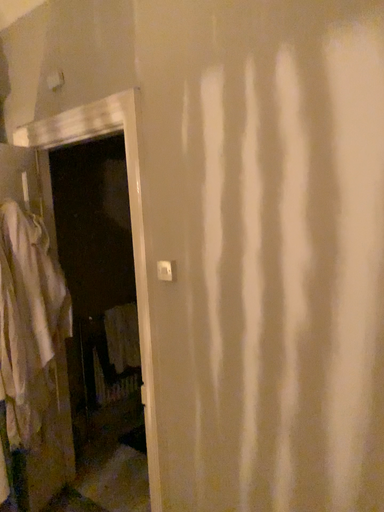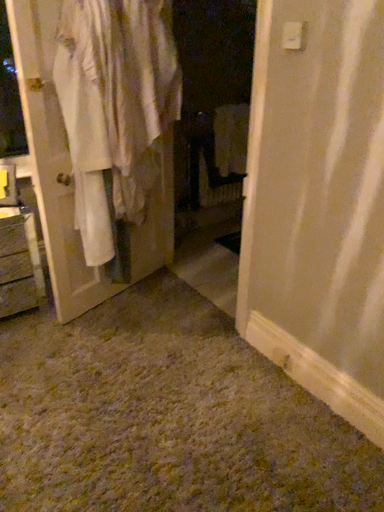
Question: Which way did the camera rotate in the video?

Choices:
 (A) rotated downward
 (B) rotated upward

Answer: (A)